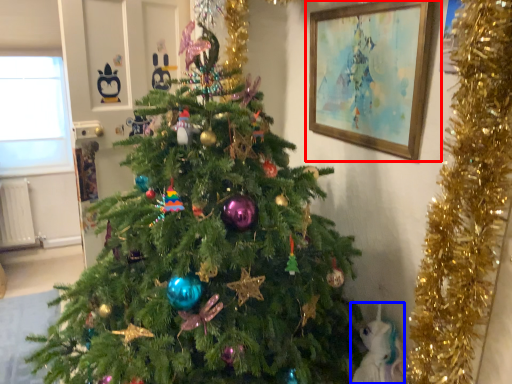
Question: Which point is closer to the camera, picture frame (highlighted by a red box) or animal (highlighted by a blue box)?

Choices:
 (A) picture frame
 (B) animal

Answer: (A)